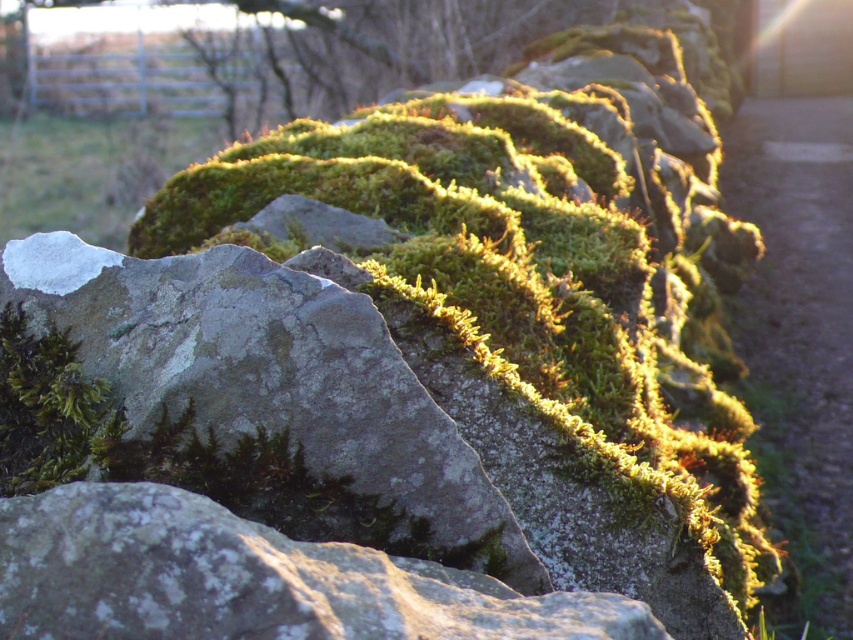
Question: Can you confirm if green mossy rock at center is positioned to the left of speckled gray rock at center?

Choices:
 (A) no
 (B) yes

Answer: (A)

Question: Is green mossy rock at center behind speckled gray rock at center?

Choices:
 (A) yes
 (B) no

Answer: (A)

Question: Based on their relative distances, which object is nearer to the green mossy rock at center?

Choices:
 (A) green mossy stone at lower right
 (B) green mossy rock at upper left
 (C) green mossy rock at upper center

Answer: (A)

Question: Among these objects, which one is farthest from the camera?

Choices:
 (A) speckled gray rock at center
 (B) green mossy rock at upper center
 (C) green mossy stone at lower right
 (D) green mossy rock at upper left

Answer: (D)

Question: Which of the following is the closest to the observer?

Choices:
 (A) (120, 193)
 (B) (757, 321)
 (C) (215, 524)
 (D) (538, 445)

Answer: (C)

Question: Is speckled gray rock at center wider than green mossy rock at upper center?

Choices:
 (A) yes
 (B) no

Answer: (B)